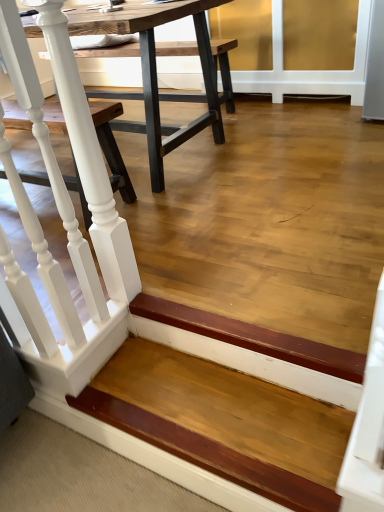
Question: Is white painted wood railing at left situated inside wooden table at center or outside?

Choices:
 (A) outside
 (B) inside

Answer: (A)

Question: From a real-world perspective, is white painted wood railing at left physically located above or below wooden table at center?

Choices:
 (A) below
 (B) above

Answer: (B)

Question: Based on their relative distances, which object is nearer to the white painted wood railing at left?

Choices:
 (A) wooden table at center
 (B) wooden step at lower left

Answer: (B)

Question: Which object is positioned farthest from the white painted wood railing at left?

Choices:
 (A) wooden table at center
 (B) wooden step at lower left

Answer: (A)